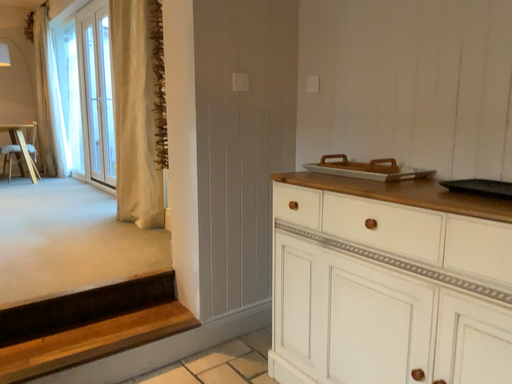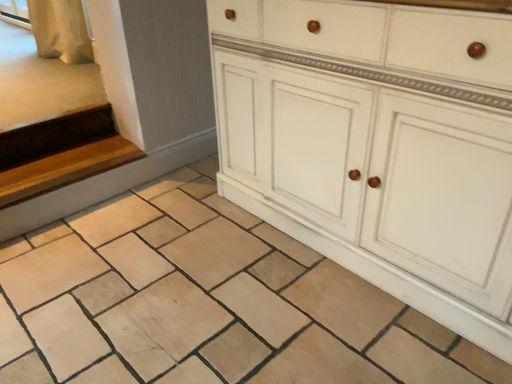
Question: Which way did the camera rotate in the video?

Choices:
 (A) rotated right
 (B) rotated left

Answer: (A)